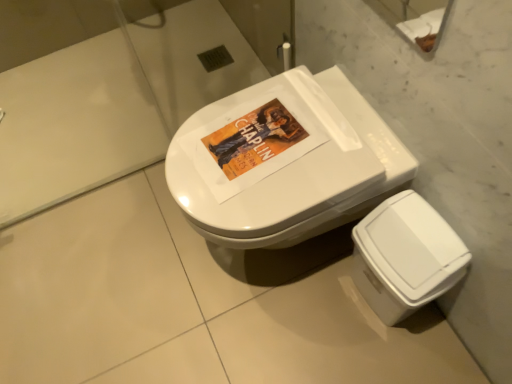
Question: From the image's perspective, is white plastic bidet at lower right under white glossy toilet at center?

Choices:
 (A) no
 (B) yes

Answer: (B)

Question: From a real-world perspective, is white plastic bidet at lower right positioned over white glossy toilet at center based on gravity?

Choices:
 (A) yes
 (B) no

Answer: (B)

Question: Could you tell me if white plastic bidet at lower right is facing white glossy toilet at center?

Choices:
 (A) yes
 (B) no

Answer: (B)

Question: Is the depth of white plastic bidet at lower right greater than that of white glossy toilet at center?

Choices:
 (A) no
 (B) yes

Answer: (B)

Question: Can you confirm if white plastic bidet at lower right is wider than white glossy toilet at center?

Choices:
 (A) yes
 (B) no

Answer: (B)

Question: Is white plastic bidet at lower right taller than white glossy toilet at center?

Choices:
 (A) yes
 (B) no

Answer: (B)

Question: Is white glossy toilet at center taller than white plastic bidet at lower right?

Choices:
 (A) yes
 (B) no

Answer: (A)

Question: Is white glossy toilet at center in contact with white plastic bidet at lower right?

Choices:
 (A) yes
 (B) no

Answer: (B)

Question: Does white glossy toilet at center come behind white plastic bidet at lower right?

Choices:
 (A) yes
 (B) no

Answer: (B)

Question: Is the position of white glossy toilet at center less distant than that of white plastic bidet at lower right?

Choices:
 (A) no
 (B) yes

Answer: (B)

Question: From a real-world perspective, is white glossy toilet at center located beneath white plastic bidet at lower right?

Choices:
 (A) no
 (B) yes

Answer: (A)

Question: Is white glossy toilet at center bigger than white plastic bidet at lower right?

Choices:
 (A) no
 (B) yes

Answer: (B)

Question: Would you say white plastic bidet at lower right is inside or outside white glossy toilet at center?

Choices:
 (A) inside
 (B) outside

Answer: (B)